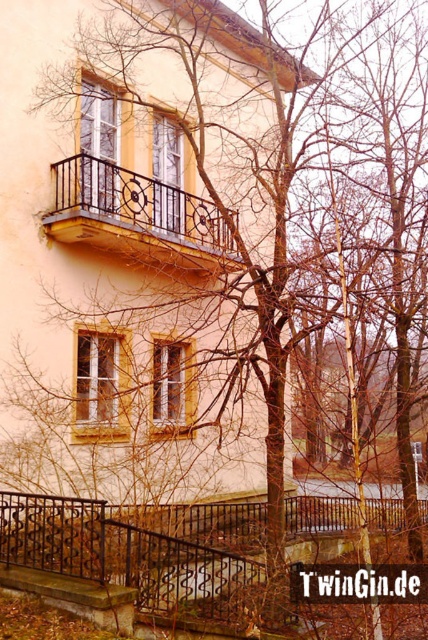
You are an architect inspecting the building facade. You notice the matte black window at upper left and the wooden textured window at center. Which window has a greater height?

The wooden textured window at center is taller than the matte black window at upper left, so it has a greater height.

You are standing at the base of the stairs and want to see the matte glass window at center. Is the black wrought iron railing at lower left blocking your view of it?

The black wrought iron railing at lower left is in front of the matte glass window at center, so it would block your view of the matte glass window at center.